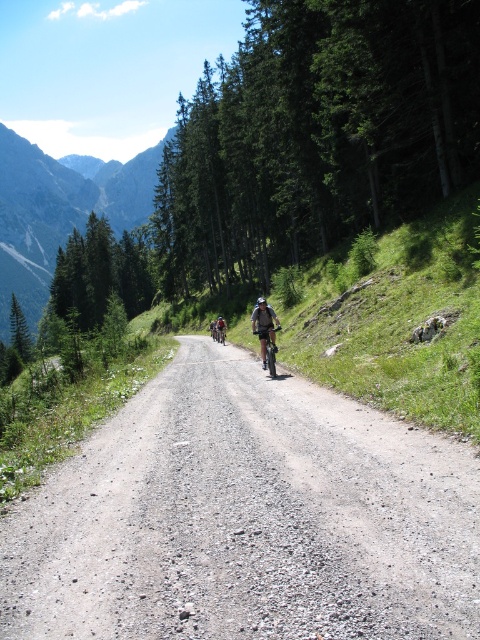
Does dusty gravel road at center come behind gray fabric helmet at center?

No, it is in front of gray fabric helmet at center.

Where is `dusty gravel road at center`? The width and height of the screenshot is (480, 640). dusty gravel road at center is located at coordinates (247, 516).

Is point (121, 477) farther from viewer compared to point (272, 324)?

No.

Find the location of `dusty gravel road at center`. dusty gravel road at center is located at coordinates (247, 516).

Who is taller, green forested mountain at upper left or gray fabric helmet at center?

Standing taller between the two is green forested mountain at upper left.

What do you see at coordinates (60, 211) in the screenshot? I see `green forested mountain at upper left` at bounding box center [60, 211].

Measure the distance between point (55, 177) and camera.

Point (55, 177) and camera are 442.33 meters apart.

Identify the location of green forested mountain at upper left. (60, 211).

Does dusty gravel road at center have a greater width compared to green forested mountain at upper left?

No.

Is dusty gravel road at center to the left of green forested mountain at upper left from the viewer's perspective?

No, dusty gravel road at center is not to the left of green forested mountain at upper left.

Between point (265, 512) and point (32, 320), which one is positioned in front?

Point (265, 512) is more forward.

In order to click on dusty gravel road at center in this screenshot , I will do `click(247, 516)`.